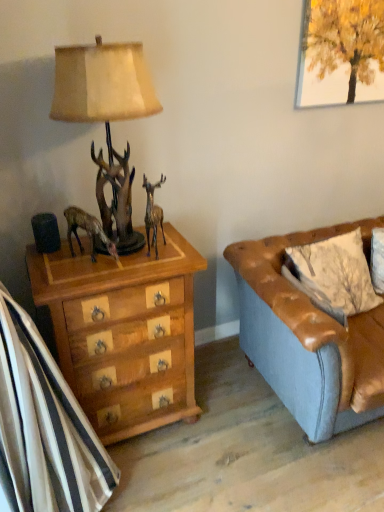
Locate an element on the screen. This screenshot has width=384, height=512. free spot in front of wooden chest of drawers at left is located at coordinates [161, 475].